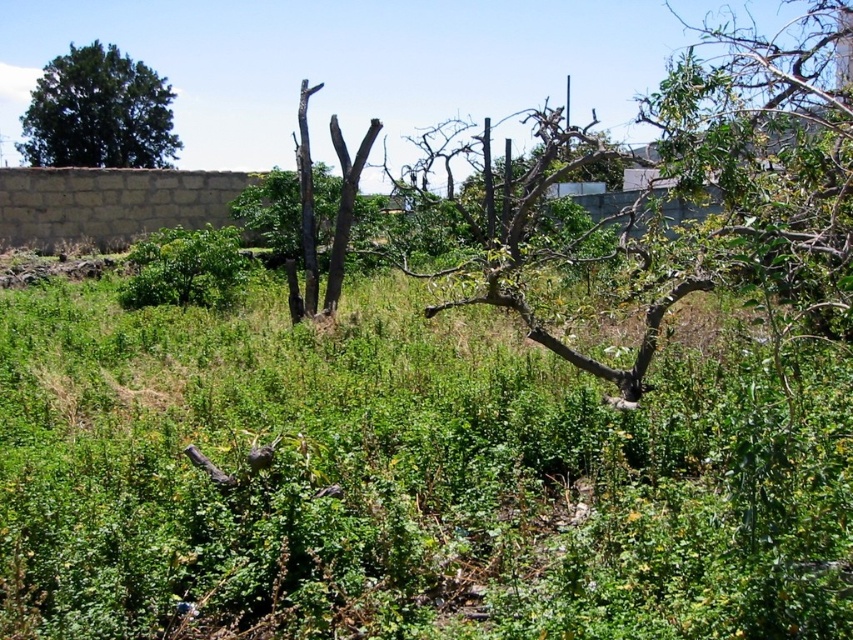
Which is more to the right, dark green leafy tree at upper left or green leafy bush at center?

green leafy bush at center

Is point (128, 61) positioned before point (207, 307)?

No.

Identify the location of dark green leafy tree at upper left. pos(97,113).